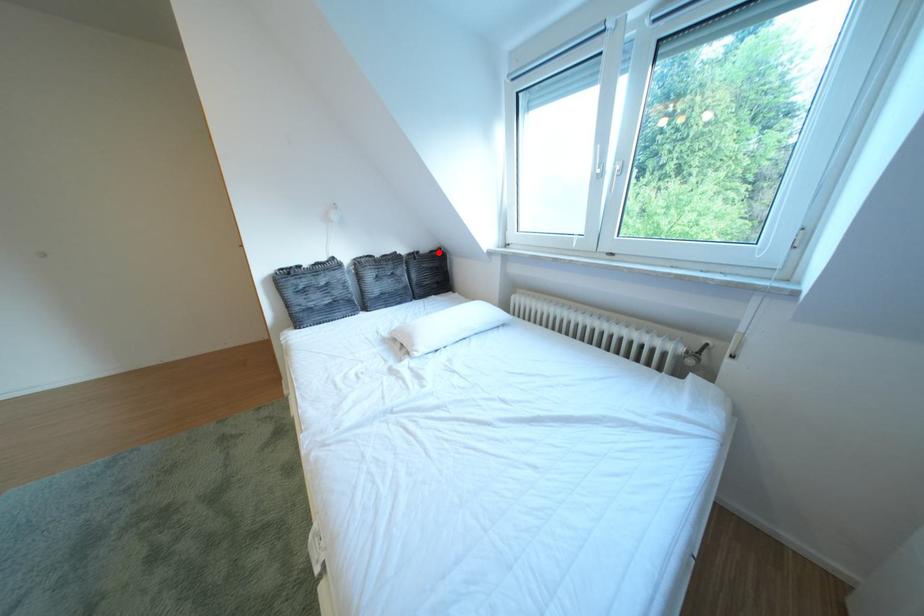
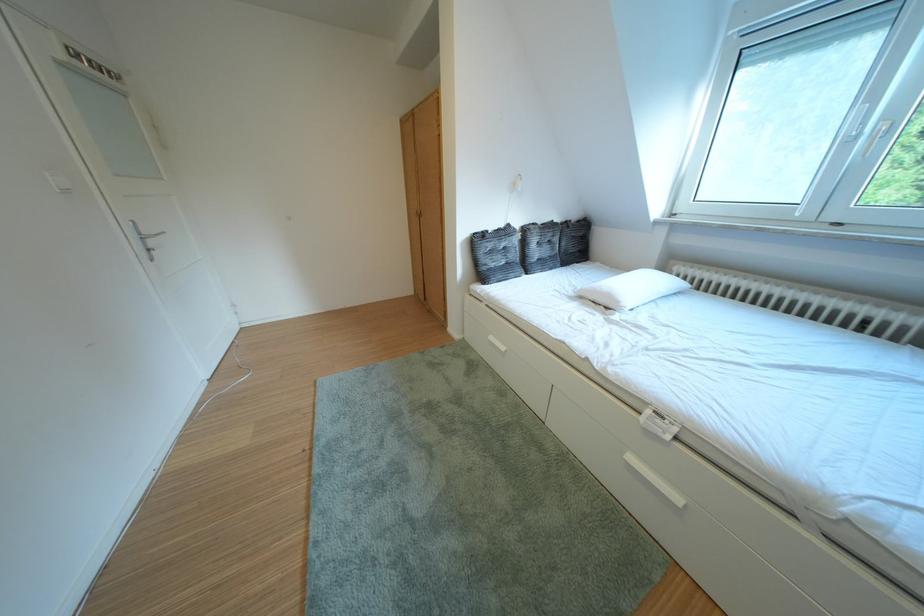
Find the pixel in the second image that matches the highlighted location in the first image.

(588, 222)